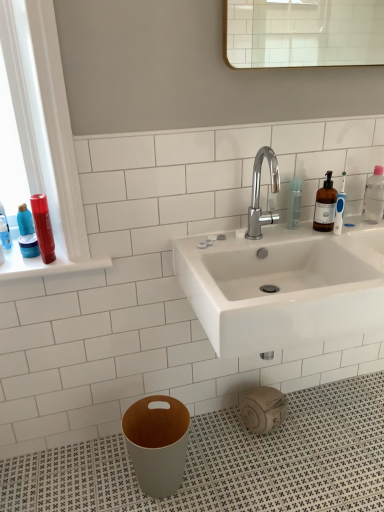
Question: Is matte plastic bottles at left surrounding shiny red hair spray at left?

Choices:
 (A) yes
 (B) no

Answer: (B)

Question: Does matte plastic bottles at left have a greater height compared to shiny red hair spray at left?

Choices:
 (A) no
 (B) yes

Answer: (A)

Question: Can you confirm if matte plastic bottles at left is smaller than shiny red hair spray at left?

Choices:
 (A) yes
 (B) no

Answer: (B)

Question: Is matte plastic bottles at left closer to camera compared to shiny red hair spray at left?

Choices:
 (A) yes
 (B) no

Answer: (B)

Question: Considering the relative sizes of matte plastic bottles at left and shiny red hair spray at left in the image provided, is matte plastic bottles at left bigger than shiny red hair spray at left?

Choices:
 (A) yes
 (B) no

Answer: (A)

Question: From the image's perspective, is matte plastic bottles at left on top of shiny red hair spray at left?

Choices:
 (A) yes
 (B) no

Answer: (B)

Question: From a real-world perspective, is clear plastic bottle at upper right positioned under matte plastic bottles at left based on gravity?

Choices:
 (A) yes
 (B) no

Answer: (B)

Question: From a real-world perspective, is clear plastic bottle at upper right positioned over matte plastic bottles at left based on gravity?

Choices:
 (A) yes
 (B) no

Answer: (A)

Question: From the image's perspective, is clear plastic bottle at upper right above matte plastic bottles at left?

Choices:
 (A) yes
 (B) no

Answer: (A)

Question: Is clear plastic bottle at upper right to the right of matte plastic bottles at left from the viewer's perspective?

Choices:
 (A) yes
 (B) no

Answer: (A)

Question: Can you confirm if clear plastic bottle at upper right is smaller than matte plastic bottles at left?

Choices:
 (A) no
 (B) yes

Answer: (B)

Question: Is clear plastic bottle at upper right oriented away from matte plastic bottles at left?

Choices:
 (A) yes
 (B) no

Answer: (B)

Question: Are chrome metallic faucet at center and clear plastic bottle at upper right beside each other?

Choices:
 (A) no
 (B) yes

Answer: (A)